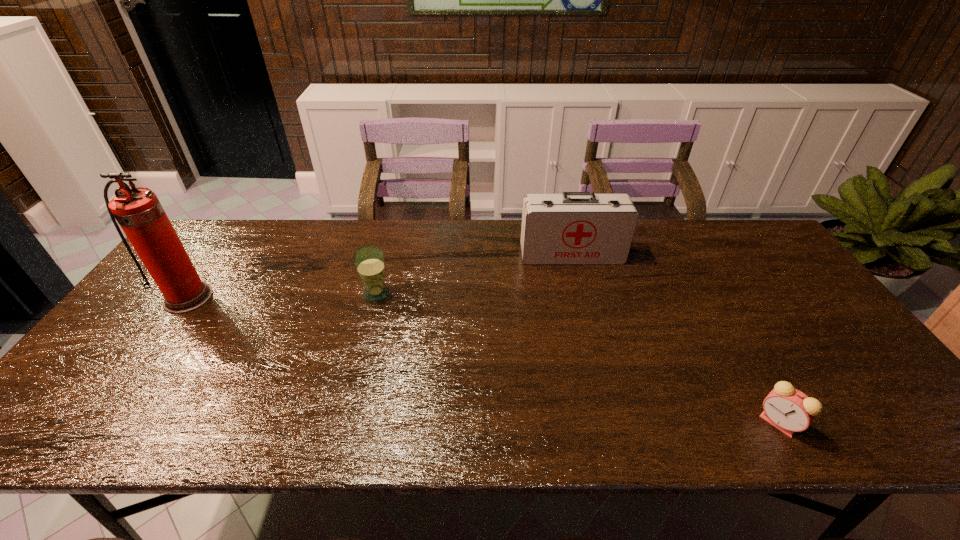
Locate an element on the screen. The width and height of the screenshot is (960, 540). fire extinguisher is located at coordinates (138, 211).

Image resolution: width=960 pixels, height=540 pixels. I want to click on the tallest object, so click(138, 211).

The image size is (960, 540). Identify the location of the third shortest object. pyautogui.click(x=574, y=228).

I want to click on the first-aid kit, so click(574, 228).

I want to click on glass, so click(369, 261).

Where is `the third object from right to left`? Image resolution: width=960 pixels, height=540 pixels. the third object from right to left is located at coordinates (369, 261).

You are a GUI agent. You are given a task and a screenshot of the screen. Output one action in this format:
    pyautogui.click(x=<x>, y=<y>)
    Task: Click on the nearest object
    The image size is (960, 540).
    Given the screenshot: What is the action you would take?
    pyautogui.click(x=789, y=410)

Locate an element on the screen. the rightmost object is located at coordinates (789, 410).

I want to click on free space located 0.340m at the discharge end of the tallest object, so click(95, 428).

Where is `free location located 0.220m on the front-facing side of the farthest object`? free location located 0.220m on the front-facing side of the farthest object is located at coordinates (588, 316).